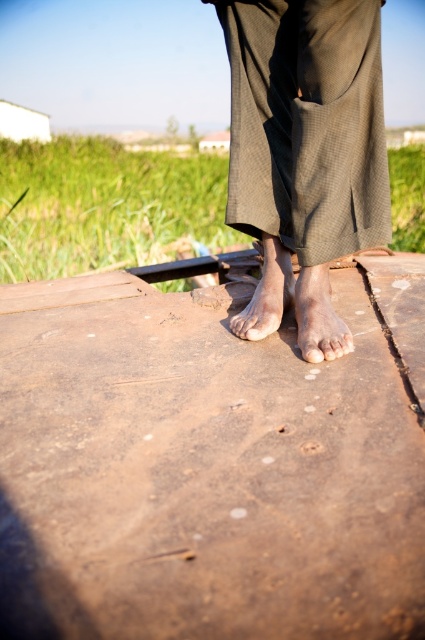
Can you confirm if dry skin foot at center is positioned to the left of pale skin toe at center?

In fact, dry skin foot at center is to the right of pale skin toe at center.

In order to click on dry skin foot at center in this screenshot , I will do `click(319, 317)`.

Based on the photo, between rusty wood plank at center and brown matte foot at center, which one is positioned higher?

Positioned higher is brown matte foot at center.

Is rusty wood plank at center thinner than brown matte foot at center?

No.

The height and width of the screenshot is (640, 425). Find the location of `rusty wood plank at center`. rusty wood plank at center is located at coordinates (209, 464).

At what (x,y) coordinates should I click in order to perform the action: click on rusty wood plank at center. Please return your answer as a coordinate pair (x, y). This screenshot has height=640, width=425. Looking at the image, I should click on (209, 464).

Can you confirm if brown textured pants at center is smaller than dry skin foot at center?

Actually, brown textured pants at center might be larger than dry skin foot at center.

Can you confirm if brown textured pants at center is taller than dry skin foot at center?

Yes.

Does point (240, 26) come farther from viewer compared to point (300, 294)?

No, it is not.

The height and width of the screenshot is (640, 425). I want to click on brown textured pants at center, so click(x=305, y=150).